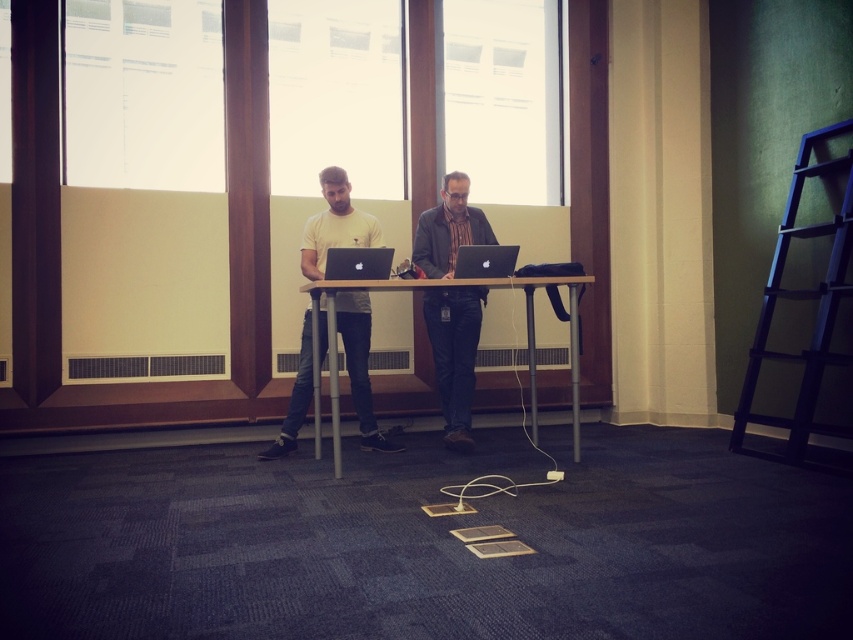
You are standing in the office and want to reach the top of the dark blue wooden ladder at right to retrieve a book placed there. If your maximum reach is 2 meters, can you reach the book without moving the ladder?

The dark blue wooden ladder at right is 3.27 meters away from the viewer. Since your maximum reach is 2 meters, you cannot reach the book placed on the top of the dark blue wooden ladder at right without moving closer or using additional equipment.